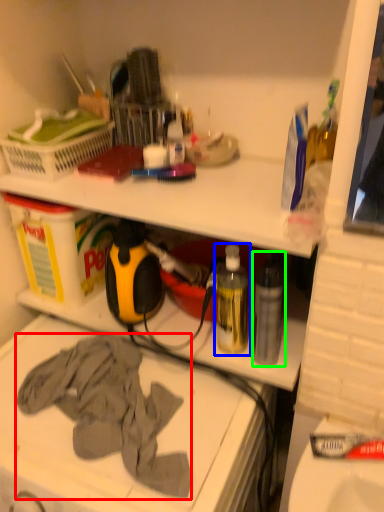
Question: Based on their relative distances, which object is nearer to clothing (highlighted by a red box)? Choose from bottle (highlighted by a blue box) and bottle (highlighted by a green box).

Choices:
 (A) bottle
 (B) bottle

Answer: (A)